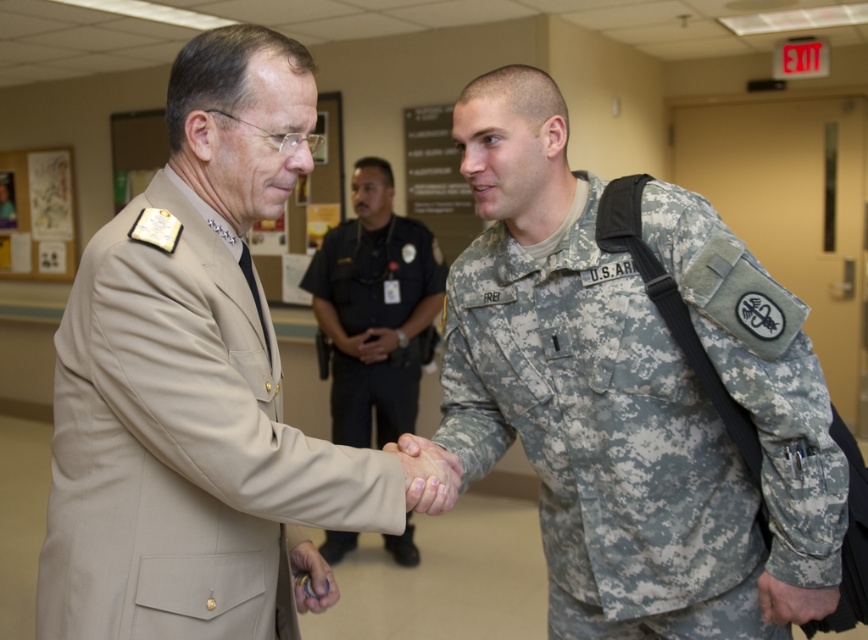
You are an observer in the scene. You notice the tan fabric uniform at center and the metallic ring at center. Which object takes up more space in the image?

The tan fabric uniform at center has a larger size compared to metallic ring at center, so it takes up more space in the image.

In the image, there is a point marked at coordinates (643, 412). The scene shows a man in a beige military uniform shaking hands with someone in a U.S. Army camouflage uniform. Can you identify what object or feature is located at the specified coordinates?

The point at coordinates (643, 412) indicates the camouflage fabric uniform at center.